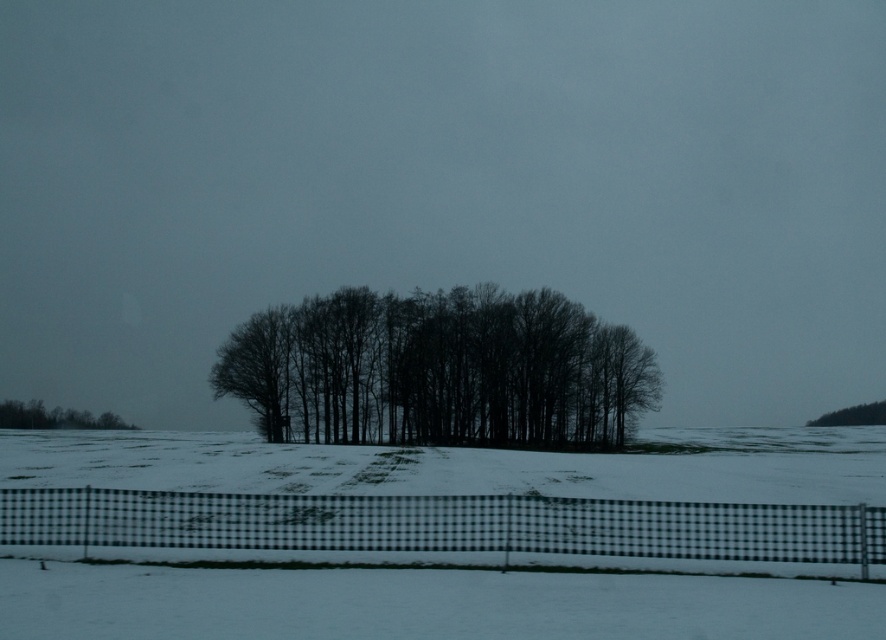
You are an observer standing in the winter landscape scene. You notice the black matte trees at center and the black checkered fence at lower center. Which object is closer to you?

The black matte trees at center are closer to you because they are positioned further to the viewer than the black checkered fence at lower center.

You are an observer standing in the winter landscape scene. You see the black matte trees at center and the green matte trees at lower left. Which group of trees is positioned higher up in the image?

The black matte trees at center is located above the green matte trees at lower left, so the black matte trees at center are positioned higher up in the image.